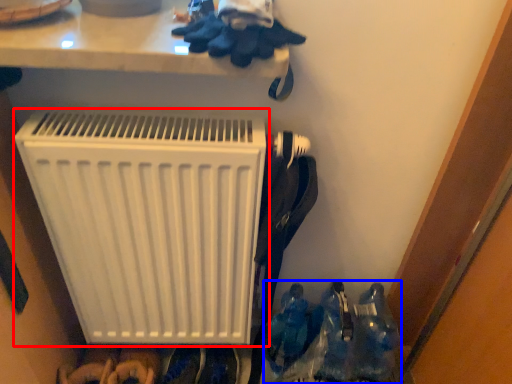
Question: Which object appears farthest to the camera in this image, home appliance (highlighted by a red box) or footwear (highlighted by a blue box)?

Choices:
 (A) home appliance
 (B) footwear

Answer: (B)